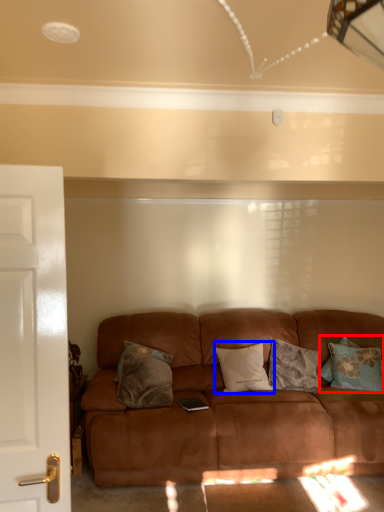
Question: Which point is further to the camera, pillow (highlighted by a red box) or pillow (highlighted by a blue box)?

Choices:
 (A) pillow
 (B) pillow

Answer: (A)